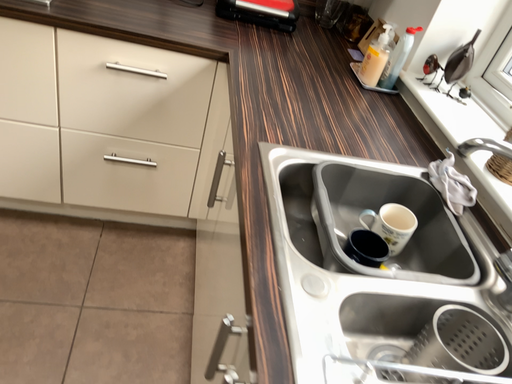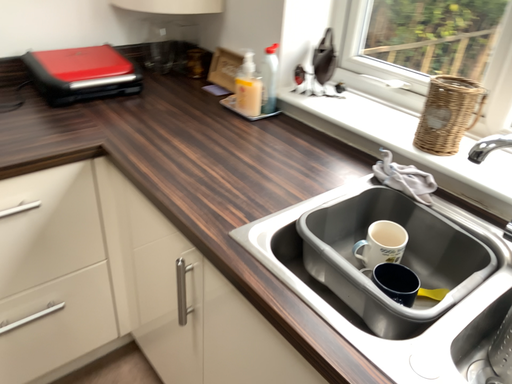
Question: Which way did the camera rotate in the video?

Choices:
 (A) rotated downward
 (B) rotated upward

Answer: (B)